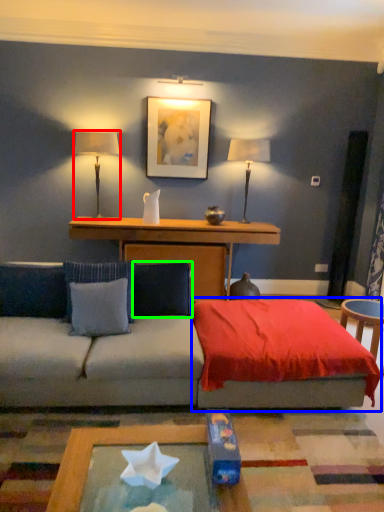
Question: Which object is the farthest from table lamp (highlighted by a red box)? Choose among these: bedding (highlighted by a blue box) or pillow (highlighted by a green box).

Choices:
 (A) bedding
 (B) pillow

Answer: (A)